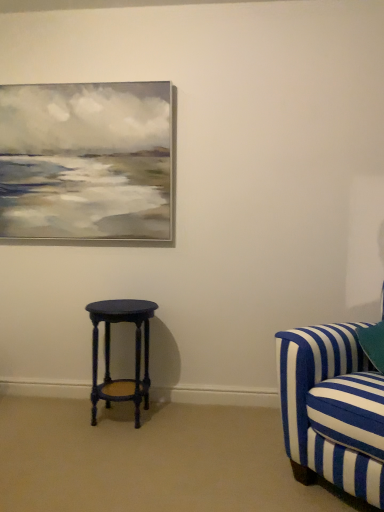
Question: Looking at the image, does blue striped fabric couch at right seem bigger or smaller compared to matte dark blue stool at lower left?

Choices:
 (A) big
 (B) small

Answer: (A)

Question: Considering the positions of point (340, 462) and point (105, 362), is point (340, 462) closer or farther from the camera than point (105, 362)?

Choices:
 (A) farther
 (B) closer

Answer: (B)

Question: From the image's perspective, is blue striped fabric couch at right above or below matte dark blue stool at lower left?

Choices:
 (A) below
 (B) above

Answer: (B)

Question: Is point (137, 349) positioned closer to the camera than point (336, 343)?

Choices:
 (A) farther
 (B) closer

Answer: (A)

Question: In terms of width, does matte dark blue stool at lower left look wider or thinner when compared to blue striped fabric couch at right?

Choices:
 (A) wide
 (B) thin

Answer: (B)

Question: Visually, is matte dark blue stool at lower left positioned to the left or to the right of blue striped fabric couch at right?

Choices:
 (A) left
 (B) right

Answer: (A)

Question: Is matte dark blue stool at lower left in front of or behind blue striped fabric couch at right in the image?

Choices:
 (A) behind
 (B) front

Answer: (A)